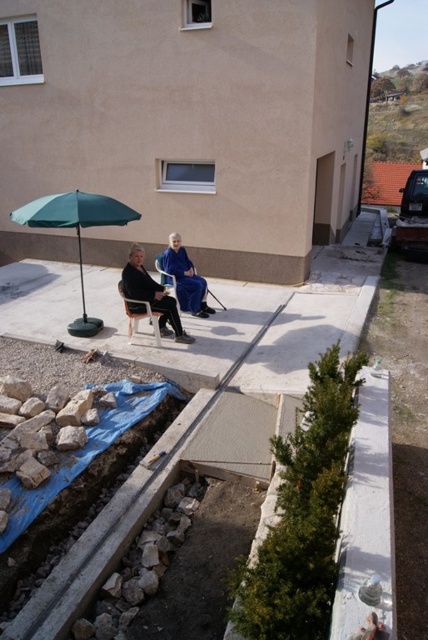
Question: Is green fabric umbrella at left smaller than blue silk robe at center?

Choices:
 (A) yes
 (B) no

Answer: (A)

Question: Estimate the real-world distances between objects in this image. Which object is farther from the wooden folding chair at center?

Choices:
 (A) blue silk robe at center
 (B) green fabric umbrella at left

Answer: (B)

Question: Which of these objects is positioned closest to the blue fabric dress at center?

Choices:
 (A) blue silk robe at center
 (B) wooden folding chair at center

Answer: (A)

Question: Is blue silk robe at center below blue fabric dress at center?

Choices:
 (A) no
 (B) yes

Answer: (B)

Question: Which point is farther to the camera?

Choices:
 (A) blue silk robe at center
 (B) blue fabric dress at center
 (C) wooden folding chair at center
 (D) green fabric umbrella at left

Answer: (B)

Question: Can you confirm if blue fabric dress at center is wider than wooden folding chair at center?

Choices:
 (A) yes
 (B) no

Answer: (A)